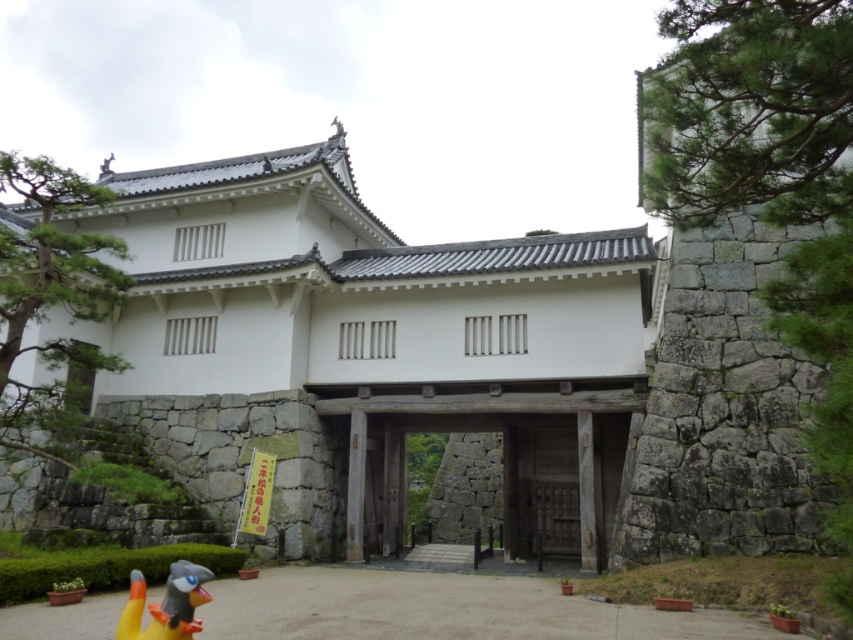
Locate an element on the screen. The image size is (853, 640). rubber yellow duck at lower left is located at coordinates (166, 604).

Is point (195, 576) positioned after point (416, 518)?

No, (195, 576) is in front of (416, 518).

Where is `rubber yellow duck at lower left`? rubber yellow duck at lower left is located at coordinates (166, 604).

Between green textured stone wall at right and rubber yellow duck at lower left, which one is positioned lower?

Positioned lower is rubber yellow duck at lower left.

Image resolution: width=853 pixels, height=640 pixels. I want to click on green textured stone wall at right, so click(x=770, y=179).

From the picture: Between green leafy tree at upper right and rubber yellow duck at lower left, which one is positioned higher?

green leafy tree at upper right is above.

Can you confirm if green leafy tree at upper right is taller than rubber yellow duck at lower left?

No.

At what (x,y) coordinates should I click in order to perform the action: click on green leafy tree at upper right. Please return your answer as a coordinate pair (x, y). Looking at the image, I should click on (749, 109).